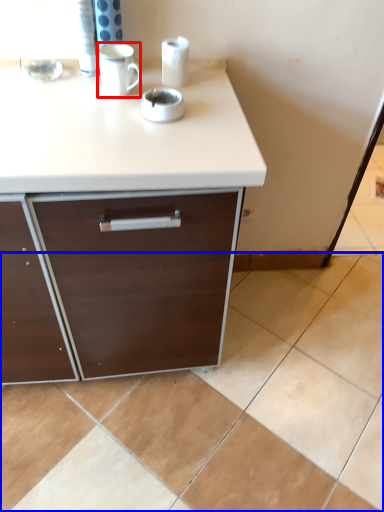
Question: Which point is closer to the camera, mug (highlighted by a red box) or ceramic tile (highlighted by a blue box)?

Choices:
 (A) mug
 (B) ceramic tile

Answer: (A)